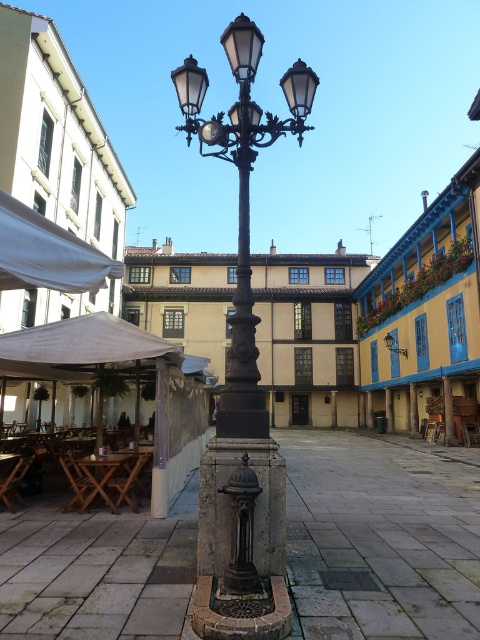
Question: Does polished bronze streetlamp at center appear on the left side of metallic wall-mounted light at upper right?

Choices:
 (A) no
 (B) yes

Answer: (B)

Question: Which of the following is the farthest from the observer?

Choices:
 (A) (x=60, y=273)
 (B) (x=239, y=385)

Answer: (B)

Question: Does polished bronze streetlamp at center appear on the right side of white fabric canopy at upper left?

Choices:
 (A) yes
 (B) no

Answer: (A)

Question: Which object is the closest to the white fabric canopy at upper left?

Choices:
 (A) polished bronze streetlamp at center
 (B) metallic wall-mounted light at upper right

Answer: (A)

Question: Which point appears farthest from the camera in this image?

Choices:
 (A) (384, 339)
 (B) (48, 260)
 (C) (253, 157)

Answer: (A)

Question: Does polished bronze streetlamp at center come in front of metallic wall-mounted light at upper right?

Choices:
 (A) yes
 (B) no

Answer: (A)